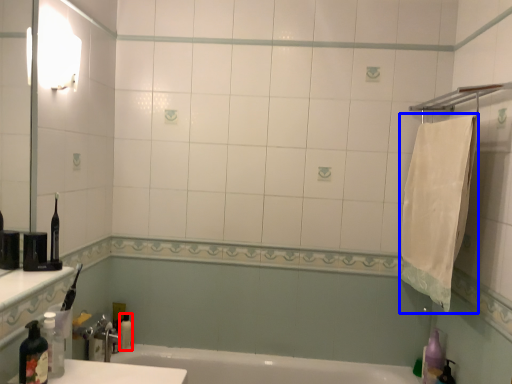
Question: Among these objects, which one is farthest to the camera, toiletry (highlighted by a red box) or bath towel (highlighted by a blue box)?

Choices:
 (A) toiletry
 (B) bath towel

Answer: (A)